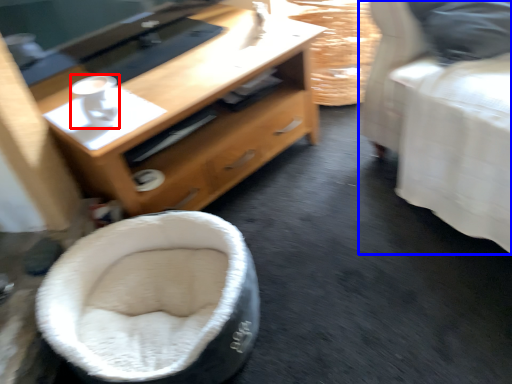
Question: Which object appears closest to the camera in this image, coffee (highlighted by a red box) or furniture (highlighted by a blue box)?

Choices:
 (A) coffee
 (B) furniture

Answer: (B)